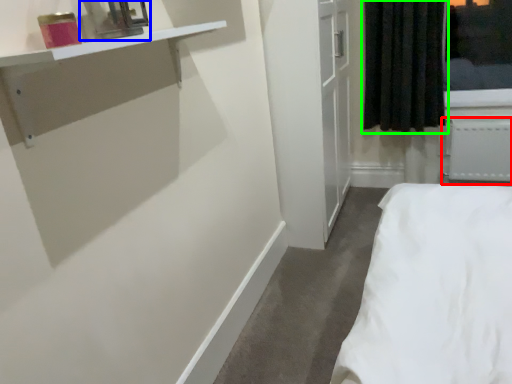
Question: Considering the real-world distances, which object is farthest from radiator (highlighted by a red box)? medicine cabinet (highlighted by a blue box) or curtain (highlighted by a green box)?

Choices:
 (A) medicine cabinet
 (B) curtain

Answer: (A)